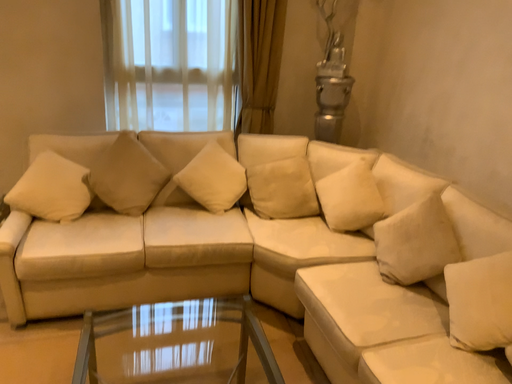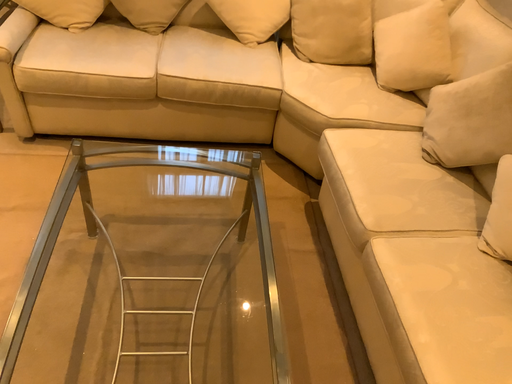
Question: Which way did the camera rotate in the video?

Choices:
 (A) rotated right
 (B) rotated left

Answer: (B)